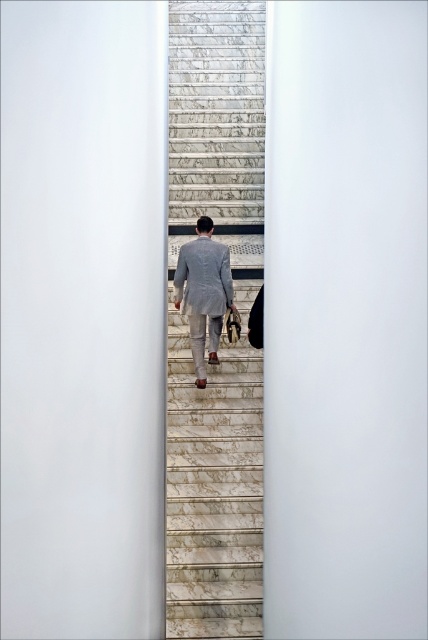
Question: Is marble stairs at center bigger than light gray suit at center?

Choices:
 (A) yes
 (B) no

Answer: (A)

Question: Which object is farther from the camera taking this photo?

Choices:
 (A) marble stairs at center
 (B) light gray suit at center

Answer: (A)

Question: Can you confirm if marble stairs at center is smaller than light gray suit at center?

Choices:
 (A) no
 (B) yes

Answer: (A)

Question: Which point is closer to the camera taking this photo?

Choices:
 (A) (178, 285)
 (B) (216, 394)

Answer: (B)

Question: Does marble stairs at center come in front of light gray suit at center?

Choices:
 (A) yes
 (B) no

Answer: (B)

Question: Among these points, which one is farthest from the camera?

Choices:
 (A) (172, 426)
 (B) (219, 250)

Answer: (B)